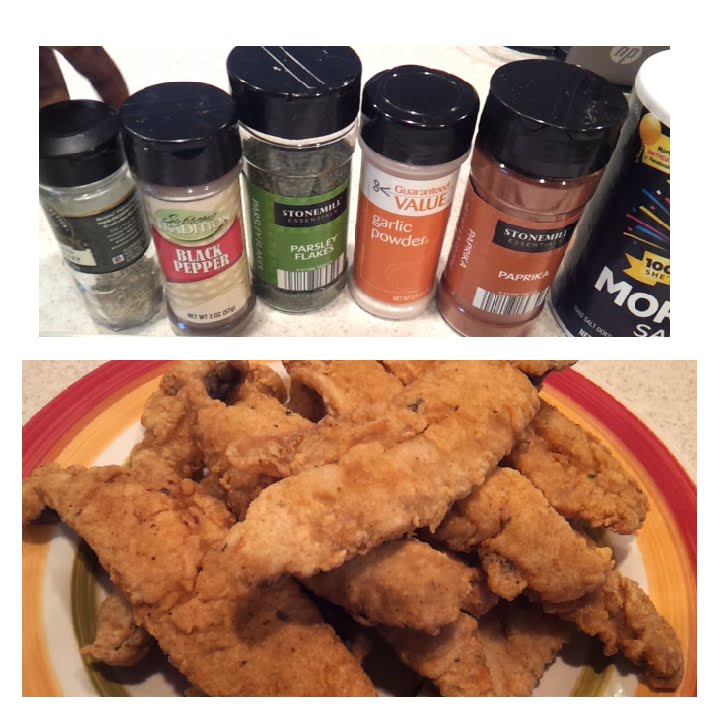
The image size is (720, 720). Find the location of `white dinner plate with red, yellow and green trim`. white dinner plate with red, yellow and green trim is located at coordinates (73, 616).